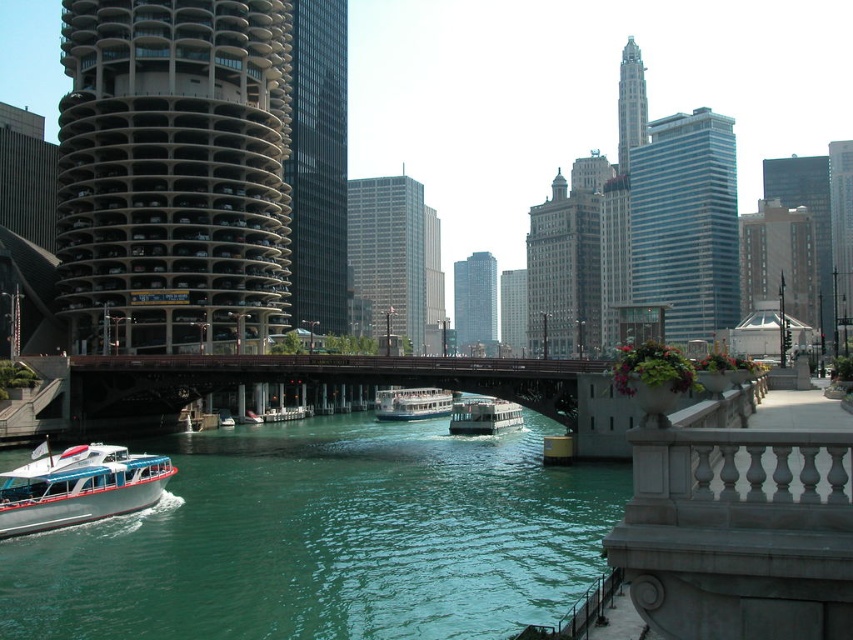
Locate an element on the screen. This screenshot has width=853, height=640. green water at lower left is located at coordinates (326, 540).

Does green water at lower left come in front of white glossy ferry at center?

Yes.

Is point (94, 556) less distant than point (379, 410)?

Yes, point (94, 556) is in front of point (379, 410).

This screenshot has width=853, height=640. I want to click on green water at lower left, so click(326, 540).

Between point (54, 470) and point (457, 422), which one is positioned in front?

Positioned in front is point (54, 470).

Does white glossy boat at lower left have a greater height compared to white glossy boat at center?

Yes, white glossy boat at lower left is taller than white glossy boat at center.

Between point (38, 483) and point (502, 413), which one is positioned behind?

The point (502, 413) is more distant.

Identify the location of white glossy boat at lower left. (79, 486).

Is green water at lower left shorter than white glossy boat at lower left?

Yes, green water at lower left is shorter than white glossy boat at lower left.

Which is in front, point (422, 480) or point (10, 531)?

Point (10, 531)

Identify the location of green water at lower left. Image resolution: width=853 pixels, height=640 pixels. (326, 540).